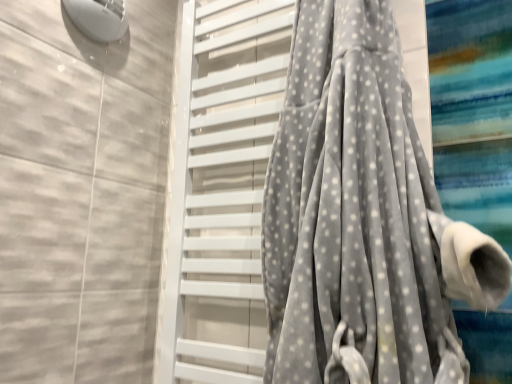
The height and width of the screenshot is (384, 512). What do you see at coordinates (352, 212) in the screenshot?
I see `gray velvety curtain at center` at bounding box center [352, 212].

I want to click on gray velvety curtain at center, so 352,212.

The height and width of the screenshot is (384, 512). What do you see at coordinates (222, 189) in the screenshot?
I see `gray velvety towel at center` at bounding box center [222, 189].

In order to face gray velvety towel at center, should I rotate leftwards or rightwards?

You should rotate right by 0.652 degrees.

Locate an element on the screen. The image size is (512, 384). gray velvety towel at center is located at coordinates (222, 189).

You are a GUI agent. You are given a task and a screenshot of the screen. Output one action in this format:
    pyautogui.click(x=<x>, y=<y>)
    Task: Click on the gray velvety curtain at center
    Image resolution: width=512 pixels, height=384 pixels.
    Given the screenshot: What is the action you would take?
    pyautogui.click(x=352, y=212)

Considering the relative positions of gray velvety curtain at center and gray velvety towel at center in the image provided, is gray velvety curtain at center to the right of gray velvety towel at center from the viewer's perspective?

Yes, gray velvety curtain at center is to the right of gray velvety towel at center.

Between gray velvety curtain at center and gray velvety towel at center, which one is positioned behind?

gray velvety towel at center is further from the camera.

Which point is more distant from viewer, (373, 226) or (292, 13)?

The point (292, 13) is farther from the camera.

From the image's perspective, which object appears higher, gray velvety curtain at center or gray velvety towel at center?

gray velvety curtain at center.

From a real-world perspective, which object rests below the other?

In real-world perspective, gray velvety curtain at center is lower.

In terms of width, does gray velvety curtain at center look wider or thinner when compared to gray velvety towel at center?

Clearly, gray velvety curtain at center has more width compared to gray velvety towel at center.

Does gray velvety curtain at center have a lesser height compared to gray velvety towel at center?

Yes, gray velvety curtain at center is shorter than gray velvety towel at center.

Who is bigger, gray velvety curtain at center or gray velvety towel at center?

With larger size is gray velvety curtain at center.

Would you say gray velvety curtain at center is inside or outside gray velvety towel at center?

gray velvety curtain at center is outside gray velvety towel at center.

Are gray velvety curtain at center and gray velvety towel at center located far from each other?

No, there isn't a large distance between gray velvety curtain at center and gray velvety towel at center.

Is gray velvety curtain at center looking in the opposite direction of gray velvety towel at center?

Yes, gray velvety curtain at center is facing away from gray velvety towel at center.

Can you tell me how much gray velvety curtain at center and gray velvety towel at center differ in facing direction?

The angular difference between gray velvety curtain at center and gray velvety towel at center is 0.00165 degrees.

Where is `curtain located above the gray velvety towel at center (from the image's perspective)`? The width and height of the screenshot is (512, 384). curtain located above the gray velvety towel at center (from the image's perspective) is located at coordinates (352, 212).

Consider the image. Is gray velvety towel at center at the left side of gray velvety curtain at center?

Yes.

Is the depth of gray velvety towel at center greater than that of gray velvety curtain at center?

Yes, gray velvety towel at center is further from the viewer.

Does point (243, 305) appear closer or farther from the camera than point (319, 299)?

Clearly, point (243, 305) is more distant from the camera than point (319, 299).

From the image's perspective, is gray velvety towel at center located above gray velvety curtain at center?

No, from the image's perspective, gray velvety towel at center is not on top of gray velvety curtain at center.

From a real-world perspective, between gray velvety towel at center and gray velvety curtain at center, who is vertically lower?

From a 3D spatial view, gray velvety curtain at center is below.

Is gray velvety towel at center thinner than gray velvety curtain at center?

Yes.

Is gray velvety towel at center taller or shorter than gray velvety curtain at center?

gray velvety towel at center is taller than gray velvety curtain at center.

Considering the relative sizes of gray velvety towel at center and gray velvety curtain at center in the image provided, is gray velvety towel at center smaller than gray velvety curtain at center?

Indeed, gray velvety towel at center has a smaller size compared to gray velvety curtain at center.

Would you say gray velvety curtain at center is part of gray velvety towel at center's contents?

No, gray velvety curtain at center is located outside of gray velvety towel at center.

Is there a large distance between gray velvety towel at center and gray velvety curtain at center?

Actually, gray velvety towel at center and gray velvety curtain at center are a little close together.

Is gray velvety towel at center facing towards gray velvety curtain at center?

Yes, gray velvety towel at center is facing gray velvety curtain at center.

Image resolution: width=512 pixels, height=384 pixels. Find the location of `curtain on the right of the gray velvety towel at center`. curtain on the right of the gray velvety towel at center is located at coordinates (352, 212).

Locate an element on the screen. This screenshot has height=384, width=512. screen door below the gray velvety curtain at center (from the image's perspective) is located at coordinates (222, 189).

Locate an element on the screen. The height and width of the screenshot is (384, 512). curtain directly beneath the gray velvety towel at center (from a real-world perspective) is located at coordinates (352, 212).